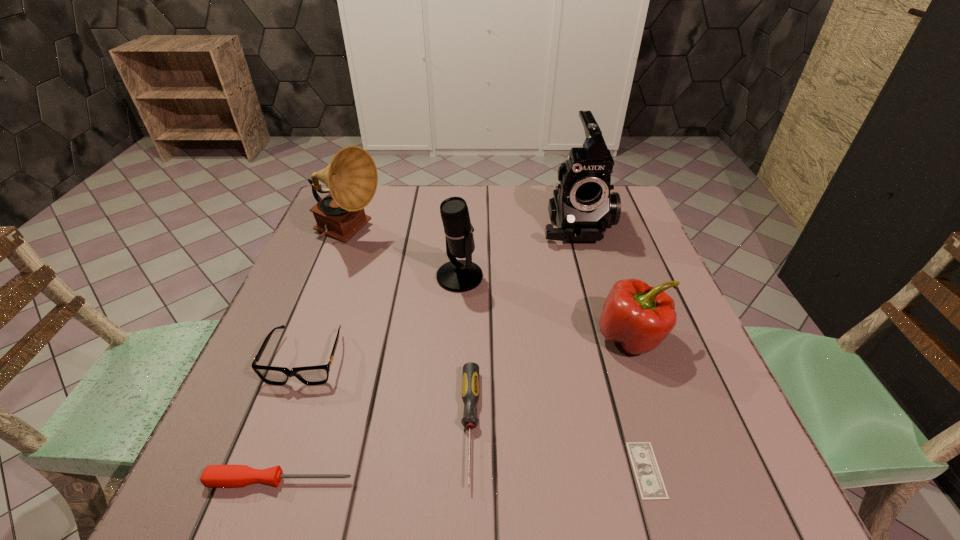
Locate an element on the screen. The height and width of the screenshot is (540, 960). free space between the right screwdriver and the sixth shortest object is located at coordinates (465, 351).

Identify the location of free space between the right screwdriver and the sixth shortest object. (465, 351).

At what (x,y) coordinates should I click in order to perform the action: click on vacant space that's between the money and the fifth shortest object. Please return your answer as a coordinate pair (x, y). The image size is (960, 540). Looking at the image, I should click on (638, 404).

In order to click on free spot between the shortest object and the phonograph record in this screenshot , I will do `click(498, 352)`.

Image resolution: width=960 pixels, height=540 pixels. I want to click on vacant area between the shortest object and the third farthest object, so click(x=553, y=373).

At what (x,y) coordinates should I click in order to perform the action: click on object that is the second closest to the shorter screwdriver. Please return your answer as a coordinate pair (x, y). The height and width of the screenshot is (540, 960). Looking at the image, I should click on (470, 381).

Find the location of `object that can be found as the third closest to the fourth shortest object`. object that can be found as the third closest to the fourth shortest object is located at coordinates (470, 381).

Image resolution: width=960 pixels, height=540 pixels. Find the location of `vacant area that satisfies the following two spatial constraints: 1. on the back side of the pepper; 2. on the right side of the shortest object`. vacant area that satisfies the following two spatial constraints: 1. on the back side of the pepper; 2. on the right side of the shortest object is located at coordinates (609, 338).

Identify the location of blank area in the image that satisfies the following two spatial constraints: 1. on the horn of the phonograph record; 2. on the left side of the sixth shortest object. (333, 277).

Identify the location of free point that satisfies the following two spatial constraints: 1. on the horn of the fourth tallest object; 2. on the right side of the phonograph record. The width and height of the screenshot is (960, 540). (310, 338).